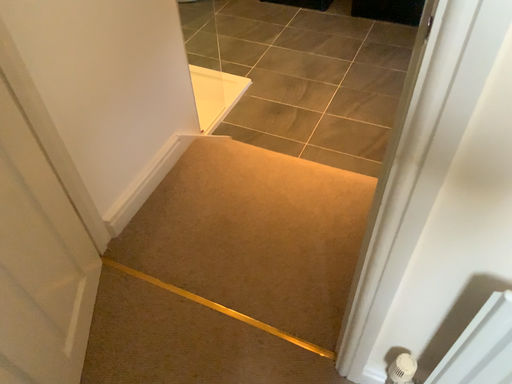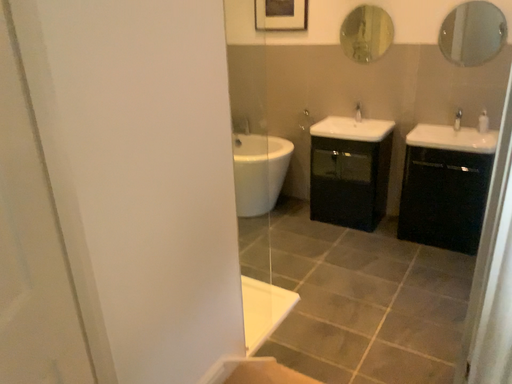
Question: Which way did the camera rotate in the video?

Choices:
 (A) rotated upward
 (B) rotated downward

Answer: (A)